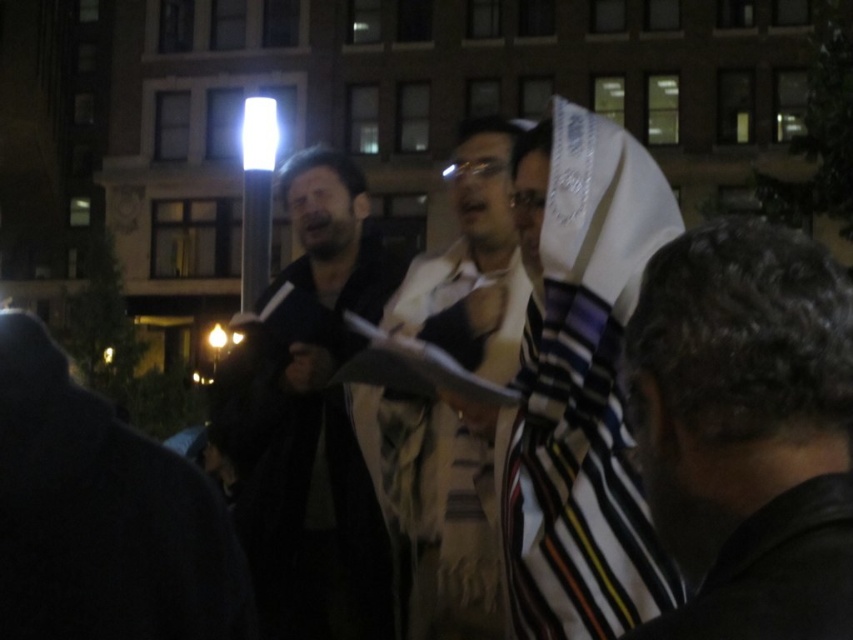
Question: Is the position of dark curly hair at lower right less distant than that of white textured scarf at center?

Choices:
 (A) no
 (B) yes

Answer: (B)

Question: Which point is closer to the camera?

Choices:
 (A) (421, 600)
 (B) (358, 445)

Answer: (A)

Question: Which point is closer to the camera?

Choices:
 (A) [x=347, y=460]
 (B) [x=729, y=298]
 (C) [x=439, y=291]

Answer: (B)

Question: Which point appears closest to the camera in this image?

Choices:
 (A) tap(467, 632)
 (B) tap(740, 512)
 (C) tap(364, 296)

Answer: (B)

Question: Does dark curly hair at lower right have a smaller size compared to dark matte jacket at center?

Choices:
 (A) no
 (B) yes

Answer: (B)

Question: Can you confirm if dark curly hair at lower right is positioned below white textured scarf at center?

Choices:
 (A) no
 (B) yes

Answer: (B)